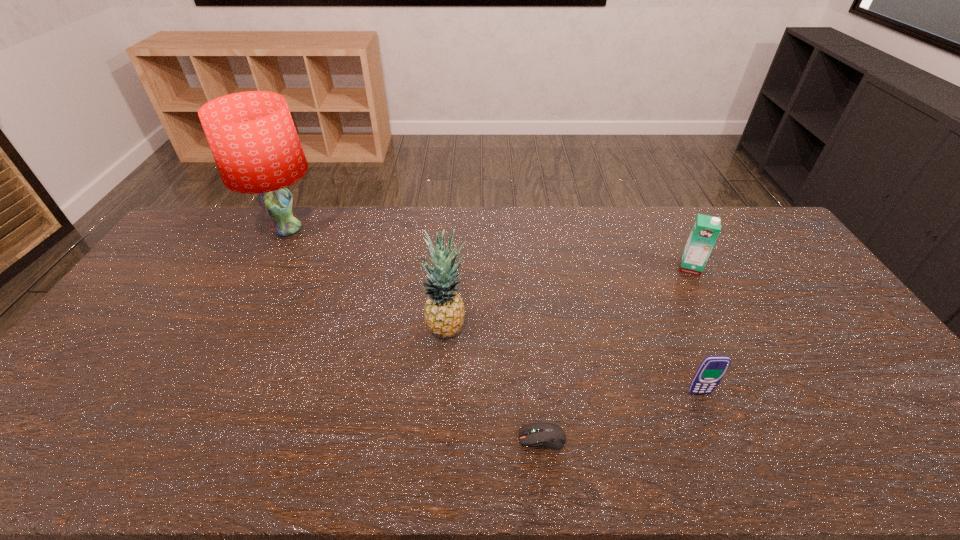
This screenshot has height=540, width=960. Find the location of `lampshade`. lampshade is located at coordinates (252, 136).

Locate an element on the screen. The image size is (960, 540). the leftmost object is located at coordinates (252, 136).

Locate an element on the screen. This screenshot has height=540, width=960. the second object from left to right is located at coordinates click(x=444, y=314).

The image size is (960, 540). Identify the location of pineapple. (444, 314).

Find the location of a particular element. This screenshot has width=960, height=540. the second farthest object is located at coordinates (705, 231).

The width and height of the screenshot is (960, 540). Identify the location of carton. (705, 231).

This screenshot has width=960, height=540. Identify the location of cellular telephone. point(710,372).

The width and height of the screenshot is (960, 540). I want to click on the second nearest object, so click(x=710, y=372).

At what (x,y) coordinates should I click in order to perform the action: click on the shortest object. Please return your answer as a coordinate pair (x, y). The height and width of the screenshot is (540, 960). Looking at the image, I should click on (546, 435).

Where is `the third object from left to right`? The height and width of the screenshot is (540, 960). the third object from left to right is located at coordinates (546, 435).